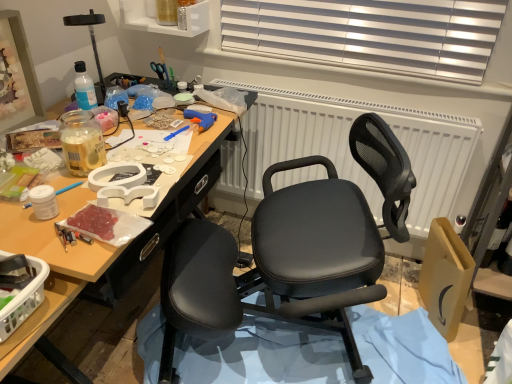
Question: Is the position of clear plastic bottle at upper center more distant than that of white textured radiator at center?

Choices:
 (A) yes
 (B) no

Answer: (A)

Question: From a real-world perspective, is clear plastic bottle at upper center under white textured radiator at center?

Choices:
 (A) yes
 (B) no

Answer: (B)

Question: Considering the relative sizes of clear plastic bottle at upper center and white textured radiator at center in the image provided, is clear plastic bottle at upper center thinner than white textured radiator at center?

Choices:
 (A) no
 (B) yes

Answer: (B)

Question: From the image's perspective, is clear plastic bottle at upper center above white textured radiator at center?

Choices:
 (A) yes
 (B) no

Answer: (A)

Question: From the image's perspective, is clear plastic bottle at upper center below white textured radiator at center?

Choices:
 (A) no
 (B) yes

Answer: (A)

Question: From the image's perspective, is translucent plastic basket at lower left above or below clear plastic bottle at upper center?

Choices:
 (A) above
 (B) below

Answer: (B)

Question: Would you say translucent plastic basket at lower left is inside or outside clear plastic bottle at upper center?

Choices:
 (A) outside
 (B) inside

Answer: (A)

Question: Based on their sizes in the image, would you say translucent plastic basket at lower left is bigger or smaller than clear plastic bottle at upper center?

Choices:
 (A) big
 (B) small

Answer: (A)

Question: Considering their positions, is translucent plastic basket at lower left located in front of or behind clear plastic bottle at upper center?

Choices:
 (A) front
 (B) behind

Answer: (A)

Question: Would you say black leather chair at center is inside or outside clear plastic bottle at upper center?

Choices:
 (A) outside
 (B) inside

Answer: (A)

Question: In the image, is black leather chair at center positioned in front of or behind clear plastic bottle at upper center?

Choices:
 (A) front
 (B) behind

Answer: (A)

Question: From the image's perspective, is black leather chair at center located above or below clear plastic bottle at upper center?

Choices:
 (A) above
 (B) below

Answer: (B)

Question: Is point (346, 292) closer or farther from the camera than point (182, 13)?

Choices:
 (A) farther
 (B) closer

Answer: (B)

Question: Considering the positions of point (298, 319) and point (12, 319), is point (298, 319) closer or farther from the camera than point (12, 319)?

Choices:
 (A) closer
 (B) farther

Answer: (B)

Question: Would you say black leather chair at center is to the left or to the right of translucent plastic basket at lower left in the picture?

Choices:
 (A) left
 (B) right

Answer: (B)